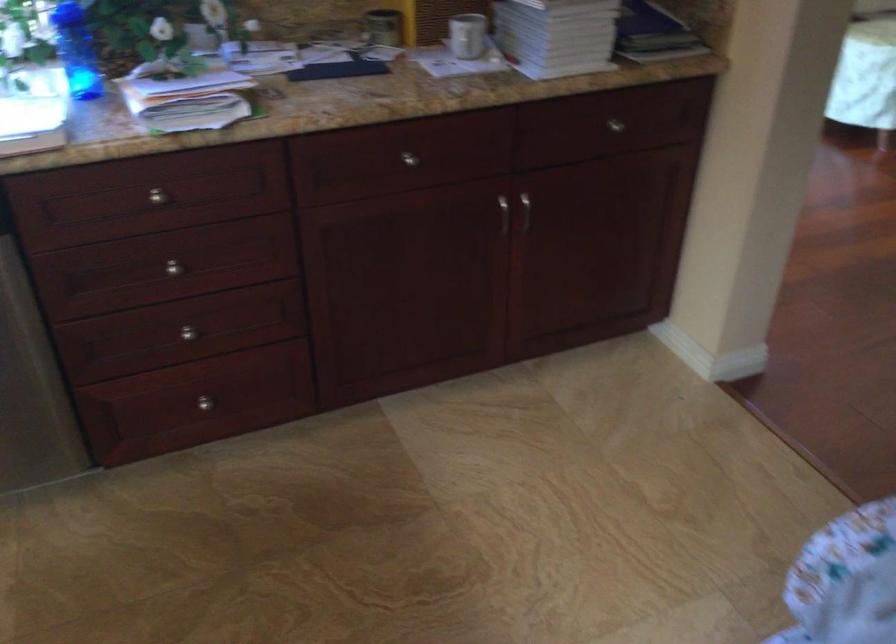
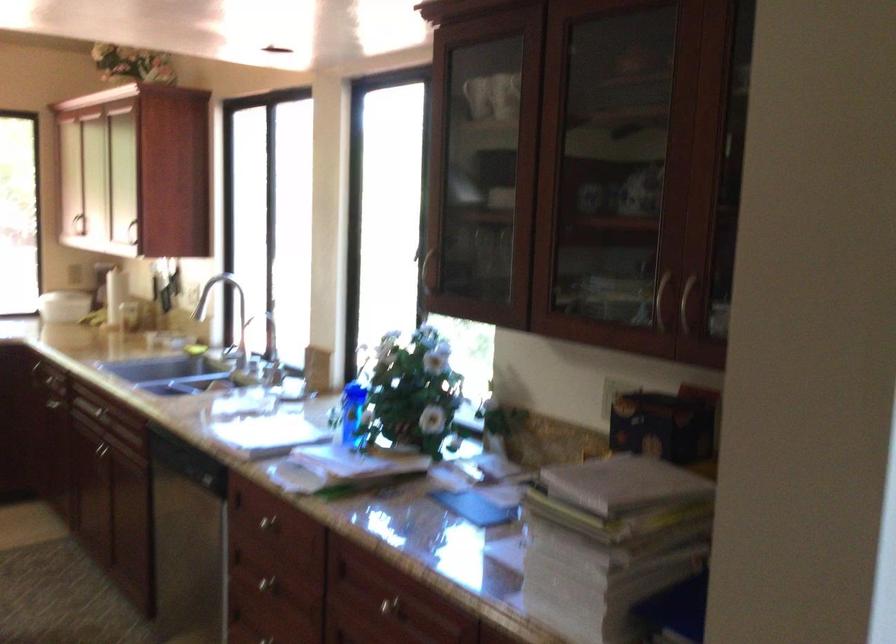
The point at [181,265] is marked in the first image. Where is the corresponding point in the second image?

(266, 583)